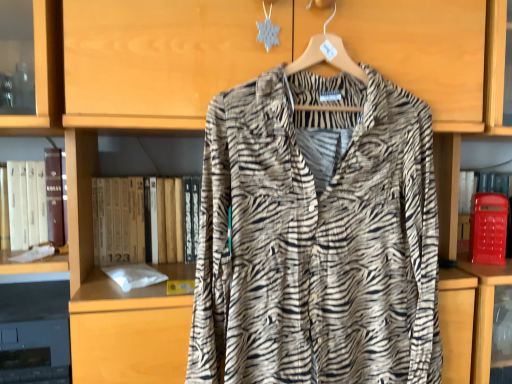
Question: From a real-world perspective, is zebra-patterned fabric shirt at center beneath hardcover book at center, the second book when ordered from left to right?

Choices:
 (A) yes
 (B) no

Answer: (B)

Question: Would you say zebra-patterned fabric shirt at center is a long distance from hardcover book at center, the second book when ordered from left to right?

Choices:
 (A) no
 (B) yes

Answer: (A)

Question: Is hardcover book at center, the second book when ordered from left to right, at the back of zebra-patterned fabric shirt at center?

Choices:
 (A) no
 (B) yes

Answer: (B)

Question: Considering the relative positions of zebra-patterned fabric shirt at center and hardcover book at center, the second book when ordered from left to right, in the image provided, is zebra-patterned fabric shirt at center behind hardcover book at center, the second book when ordered from left to right,?

Choices:
 (A) yes
 (B) no

Answer: (B)

Question: Is zebra-patterned fabric shirt at center to the left of hardcover book at center, positioned as the first book in right-to-left order, from the viewer's perspective?

Choices:
 (A) yes
 (B) no

Answer: (B)

Question: Is zebra-patterned fabric shirt at center not inside hardcover book at center, positioned as the first book in right-to-left order?

Choices:
 (A) no
 (B) yes

Answer: (B)

Question: Are hardcover book at center, positioned as the first book in right-to-left order, and white paper at left, the 2th book viewed from the right, located far from each other?

Choices:
 (A) yes
 (B) no

Answer: (B)

Question: Considering the relative positions of hardcover book at center, the second book when ordered from left to right, and white paper at left, placed as the 1th book when sorted from left to right, in the image provided, is hardcover book at center, the second book when ordered from left to right, to the right of white paper at left, placed as the 1th book when sorted from left to right, from the viewer's perspective?

Choices:
 (A) yes
 (B) no

Answer: (A)

Question: Can you confirm if hardcover book at center, the second book when ordered from left to right, is shorter than white paper at left, the 2th book viewed from the right?

Choices:
 (A) yes
 (B) no

Answer: (B)

Question: Is hardcover book at center, the second book when ordered from left to right, turned away from white paper at left, the 2th book viewed from the right?

Choices:
 (A) no
 (B) yes

Answer: (A)

Question: Can you confirm if hardcover book at center, positioned as the first book in right-to-left order, is positioned to the left of white paper at left, placed as the 1th book when sorted from left to right?

Choices:
 (A) no
 (B) yes

Answer: (A)

Question: From the image's perspective, is hardcover book at center, positioned as the first book in right-to-left order, under white paper at left, the 2th book viewed from the right?

Choices:
 (A) yes
 (B) no

Answer: (A)

Question: Is white paper at left, the 2th book viewed from the right, positioned far away from hardcover book at center, positioned as the first book in right-to-left order?

Choices:
 (A) yes
 (B) no

Answer: (B)